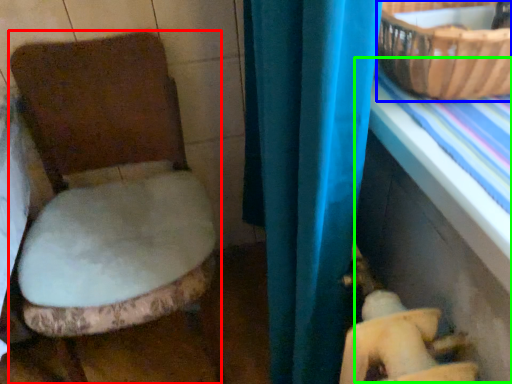
Question: Considering the real-world distances, which object is closest to toilet (highlighted by a red box)? basket (highlighted by a blue box) or table (highlighted by a green box).

Choices:
 (A) basket
 (B) table

Answer: (B)